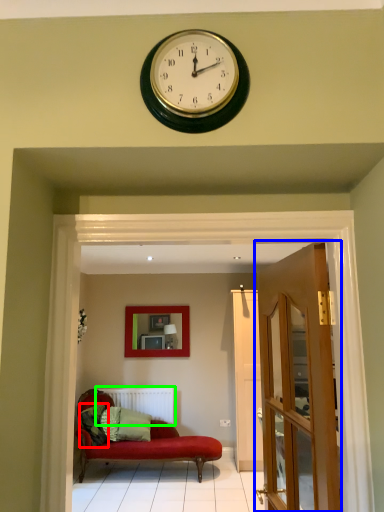
Question: Based on their relative distances, which object is farther from pillow (highlighted by a red box)? Choose from door (highlighted by a blue box) and radiator (highlighted by a green box).

Choices:
 (A) door
 (B) radiator

Answer: (A)